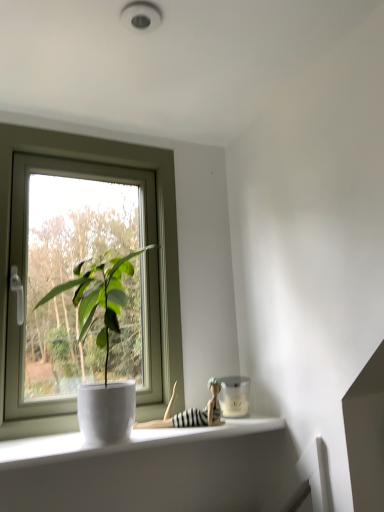
Question: From the image's perspective, is white glossy pot at window located beneath white plastic window at left?

Choices:
 (A) yes
 (B) no

Answer: (A)

Question: Does white glossy pot at window turn towards white plastic window at left?

Choices:
 (A) yes
 (B) no

Answer: (B)

Question: From a real-world perspective, is white glossy pot at window on white plastic window at left?

Choices:
 (A) yes
 (B) no

Answer: (B)

Question: Is white glossy pot at window in front of white plastic window at left?

Choices:
 (A) yes
 (B) no

Answer: (A)

Question: Considering the relative positions of white glossy pot at window and white plastic window at left in the image provided, is white glossy pot at window to the right of white plastic window at left from the viewer's perspective?

Choices:
 (A) no
 (B) yes

Answer: (B)

Question: Is white plastic window at left situated inside white glossy pot at window or outside?

Choices:
 (A) outside
 (B) inside

Answer: (A)

Question: Is point (0, 412) closer or farther from the camera than point (89, 268)?

Choices:
 (A) closer
 (B) farther

Answer: (A)

Question: From a real-world perspective, is white plastic window at left above or below white glossy pot at window?

Choices:
 (A) below
 (B) above

Answer: (B)

Question: From their relative heights in the image, would you say white plastic window at left is taller or shorter than white glossy pot at window?

Choices:
 (A) tall
 (B) short

Answer: (A)

Question: Is point (119, 435) closer or farther from the camera than point (38, 151)?

Choices:
 (A) closer
 (B) farther

Answer: (A)

Question: From a real-world perspective, is white glossy pot at window above or below white plastic window at left?

Choices:
 (A) below
 (B) above

Answer: (A)

Question: Is white glossy pot at window to the left or to the right of white plastic window at left in the image?

Choices:
 (A) right
 (B) left

Answer: (A)

Question: Is white glossy pot at window in front of or behind white plastic window at left in the image?

Choices:
 (A) front
 (B) behind

Answer: (A)

Question: From a real-world perspective, is striped fabric doll at lower center positioned above or below white glossy pot at window?

Choices:
 (A) below
 (B) above

Answer: (A)

Question: Is striped fabric doll at lower center situated inside white glossy pot at window or outside?

Choices:
 (A) outside
 (B) inside

Answer: (A)